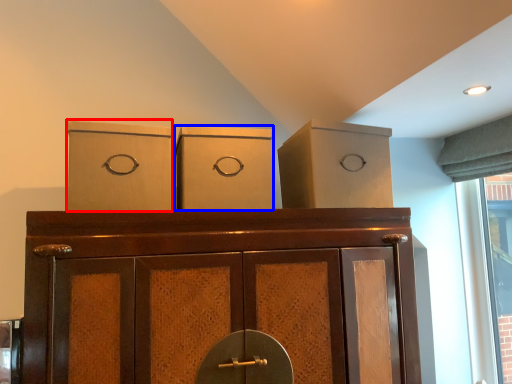
Question: Which point is further to the camera, cardboard box (highlighted by a red box) or cardboard box (highlighted by a blue box)?

Choices:
 (A) cardboard box
 (B) cardboard box

Answer: (B)